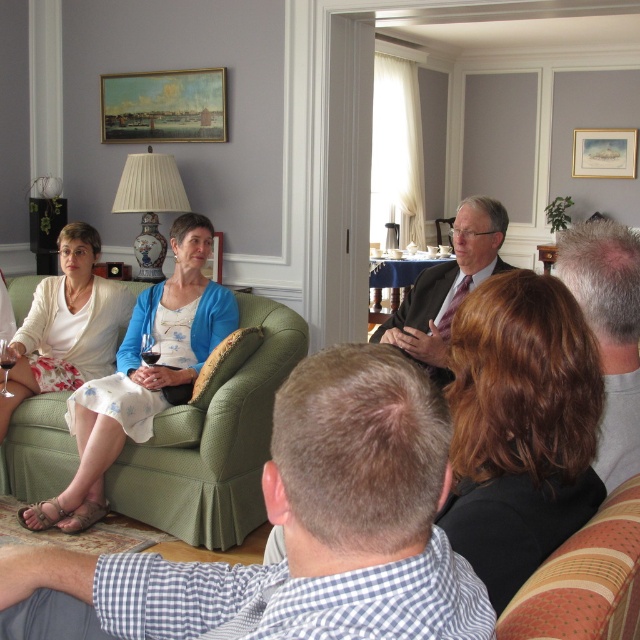
Question: Which is nearer to the matte green couch at center?

Choices:
 (A) brown hair at center
 (B) matte white blouse at center
 (C) matte white dress at center

Answer: (A)

Question: Which object is closer to the camera taking this photo?

Choices:
 (A) brown hair at center
 (B) matte green couch at center
 (C) matte white blouse at center

Answer: (B)

Question: Which point appears closest to the camera in this image?

Choices:
 (A) (621, 259)
 (B) (60, 356)

Answer: (A)

Question: Is matte white dress at center smaller than matte white blouse at center?

Choices:
 (A) no
 (B) yes

Answer: (A)

Question: Can you confirm if matte white dress at center is smaller than matte white blouse at center?

Choices:
 (A) yes
 (B) no

Answer: (B)

Question: Can you confirm if matte white dress at center is bigger than matte green couch at center?

Choices:
 (A) yes
 (B) no

Answer: (A)